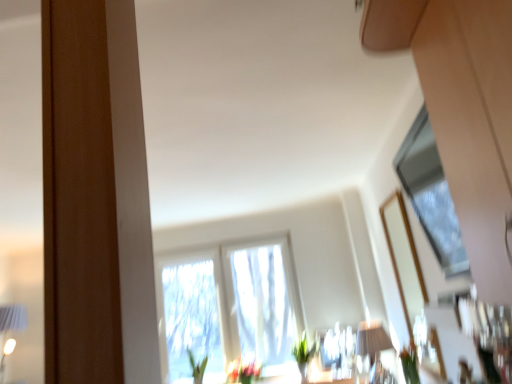
Question: In terms of width, does green matte vase at lower center, acting as the 1th plant starting from the back, look wider or thinner when compared to matte white table lamp at lower center?

Choices:
 (A) wide
 (B) thin

Answer: (B)

Question: From their relative heights in the image, would you say green matte vase at lower center, which ranks as the first plant in bottom-to-top order, is taller or shorter than matte white table lamp at lower center?

Choices:
 (A) tall
 (B) short

Answer: (B)

Question: Which of these objects is positioned closest to the translucent glass vase at center?

Choices:
 (A) matte white table lamp at lower center
 (B) green matte vase at lower center, acting as the 1th plant starting from the back
 (C) green matte plant at lower right, the 1th plant from the right
 (D) transparent glass window at upper right, the 1th window when ordered from top to bottom
 (E) translucent fabric window at center, the 1th window in the back-to-front sequence

Answer: (B)

Question: Estimate the real-world distances between objects in this image. Which object is closer to the green matte plant at lower right, acting as the second plant starting from the bottom?

Choices:
 (A) translucent fabric window at center, which ranks as the first window in left-to-right order
 (B) transparent glass window at upper right, the second window from the left
 (C) translucent glass vase at center
 (D) green matte vase at lower center, the 2th plant from the top
 (E) matte white table lamp at lower center

Answer: (E)